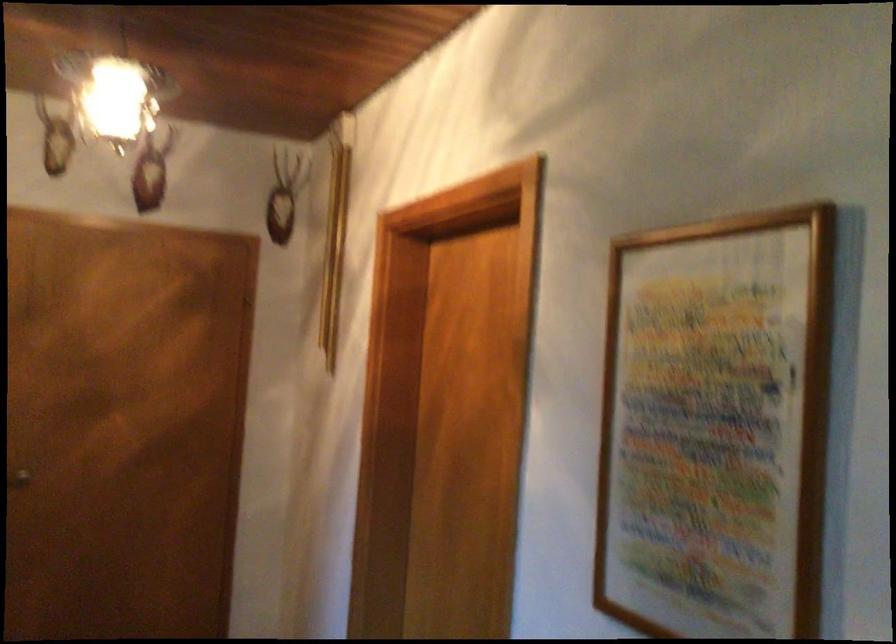
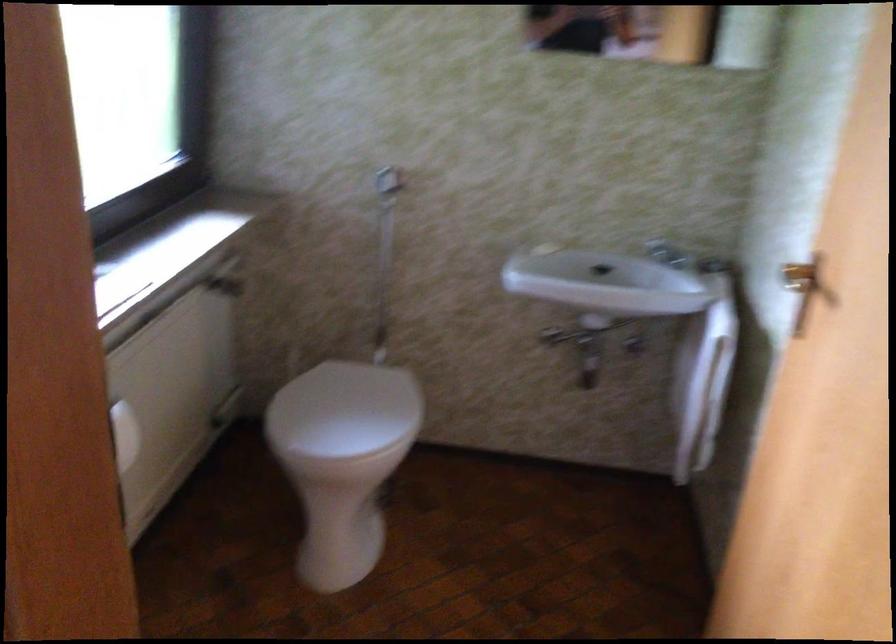
First-person continuous shooting, in which direction is the camera rotating?

The rotation direction of the camera is left-down.